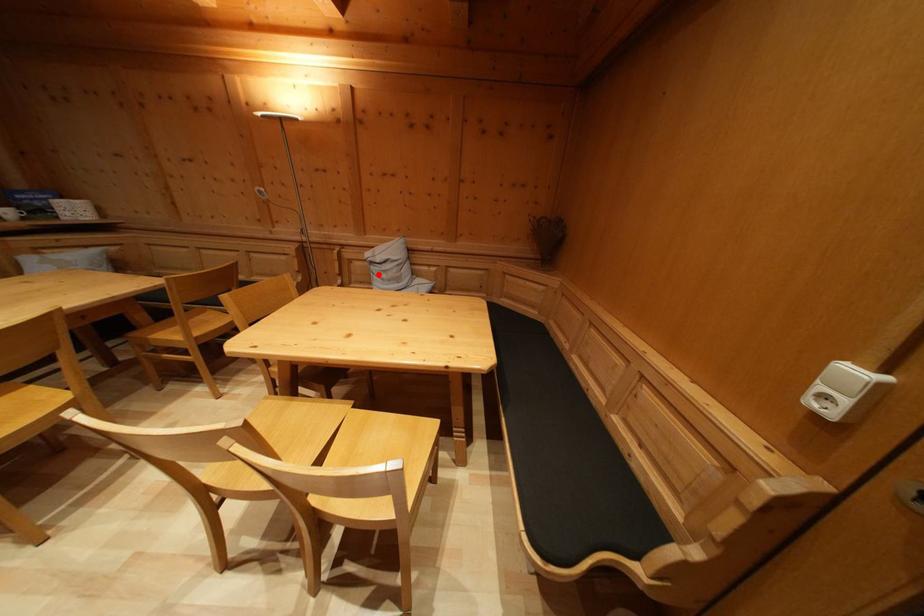
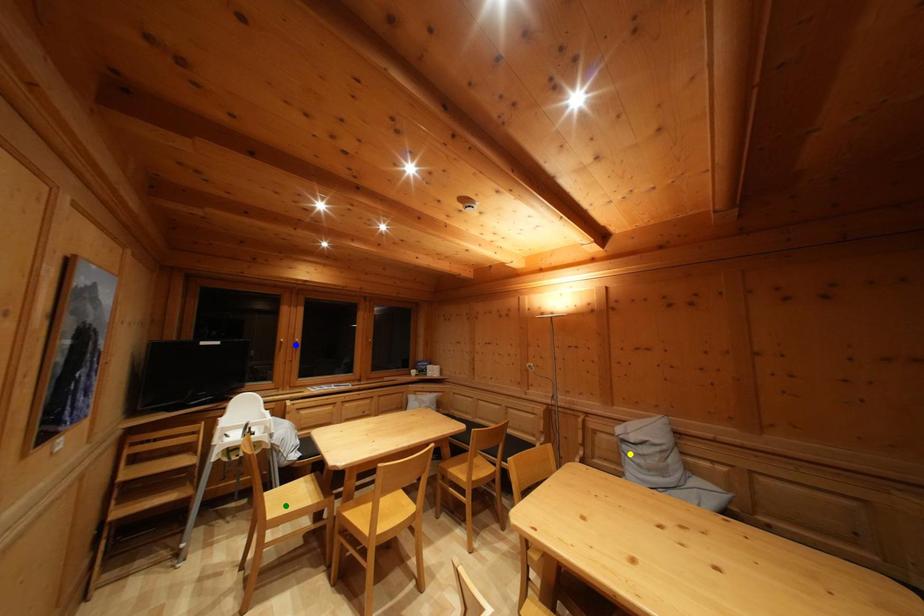
Question: I am providing you with two images of the same scene from different viewpoints. A red point is marked on the first image. You are given multiple points on the second image. Which point in image 2 represents the same 3d spot as the red point in image 1?

Choices:
 (A) green point
 (B) yellow point
 (C) blue point

Answer: (B)